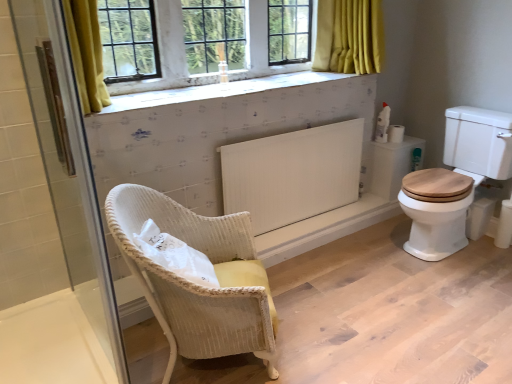
Image resolution: width=512 pixels, height=384 pixels. Find the location of `vacant area on top of white textured tile at upper center (from a real-world perspective)`. vacant area on top of white textured tile at upper center (from a real-world perspective) is located at coordinates (216, 92).